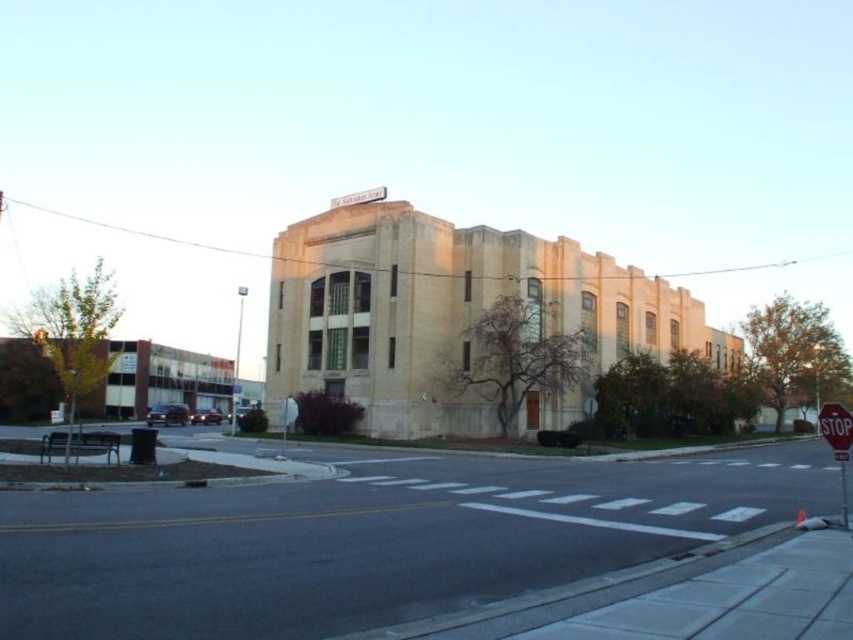
Is point (830, 420) positioned behind point (340, 205)?

No, (830, 420) is in front of (340, 205).

Which is in front, point (831, 432) or point (370, 188)?

Positioned in front is point (831, 432).

Where is `red matte stop sign at lower right`? The height and width of the screenshot is (640, 853). red matte stop sign at lower right is located at coordinates (834, 426).